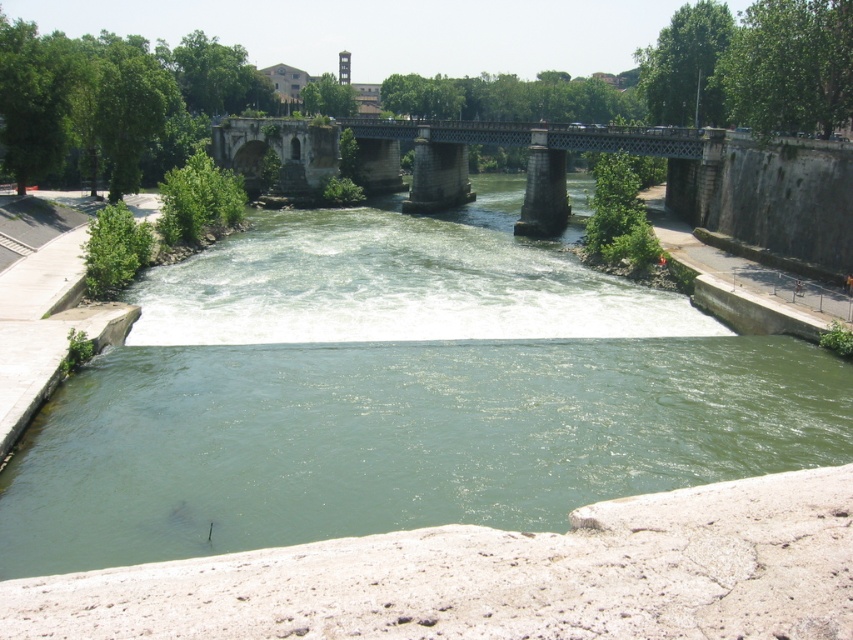
Looking at this image, does green concrete river at center have a greater width compared to stone bridge at center?

Incorrect, green concrete river at center's width does not surpass stone bridge at center's.

Who is more distant from viewer, [126,504] or [392,122]?

Point [392,122]

At what (x,y) coordinates should I click in order to perform the action: click on green concrete river at center. Please return your answer as a coordinate pair (x, y). The height and width of the screenshot is (640, 853). Looking at the image, I should click on (397, 394).